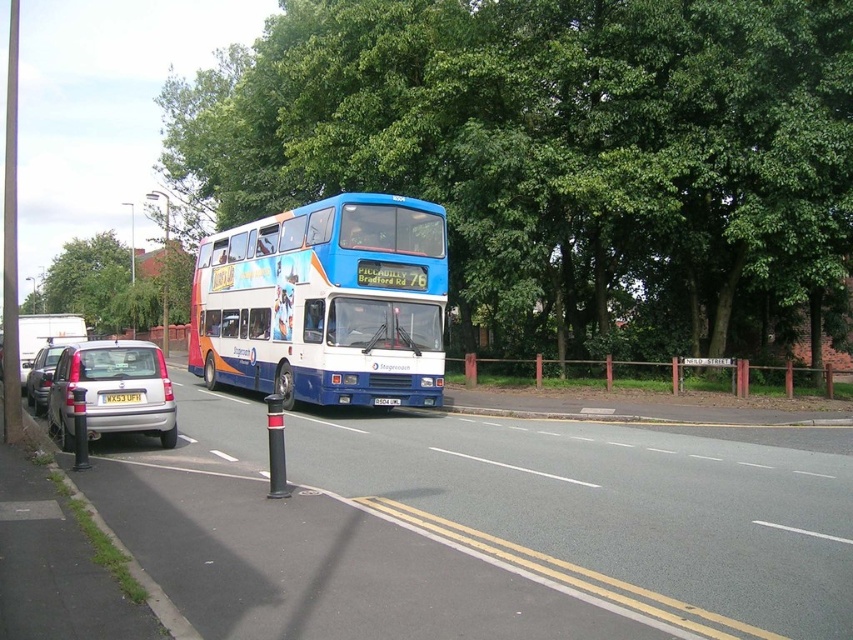
You are a pedestrian standing on the sidewalk and see the blue painted decker bus at center and the wooden sign at center. Which object is higher from the ground?

The blue painted decker bus at center is located above the wooden sign at center, so the blue painted decker bus at center is higher from the ground.